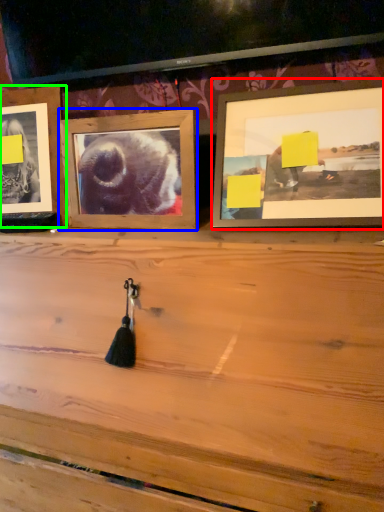
Question: Which object is positioned closest to picture frame (highlighted by a red box)? Select from picture frame (highlighted by a blue box) and picture frame (highlighted by a green box).

Choices:
 (A) picture frame
 (B) picture frame

Answer: (A)